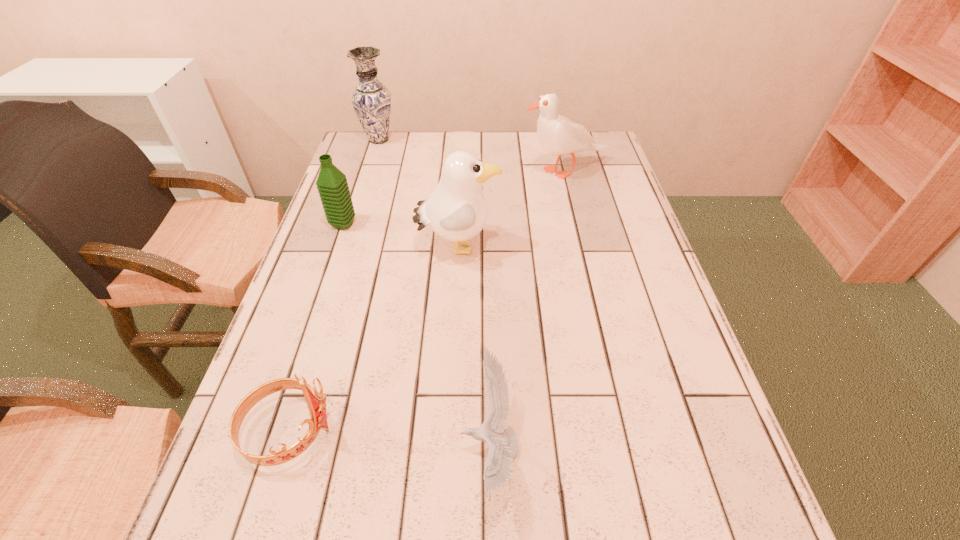
The image size is (960, 540). Find the location of `object at the near edge`. object at the near edge is located at coordinates (503, 442).

Locate an element on the screen. The height and width of the screenshot is (540, 960). vase present at the left edge is located at coordinates (371, 100).

Find the location of a particular element. water bottle at the left edge is located at coordinates (332, 185).

This screenshot has height=540, width=960. In order to click on tiara that is at the left edge in this screenshot , I will do `click(316, 401)`.

Locate an element on the screen. The width and height of the screenshot is (960, 540). object that is at the right edge is located at coordinates (557, 135).

In order to click on object at the far left corner in this screenshot , I will do `click(371, 100)`.

Identify the location of object that is positioned at the far right corner. click(x=557, y=135).

I want to click on free space at the far edge of the desktop, so click(x=404, y=168).

At what (x,y) coordinates should I click in order to perform the action: click on free space at the left edge of the desktop. Please return your answer as a coordinate pair (x, y). The width and height of the screenshot is (960, 540). Looking at the image, I should click on (291, 355).

Locate an element on the screen. This screenshot has height=540, width=960. free space at the right edge of the desktop is located at coordinates (646, 238).